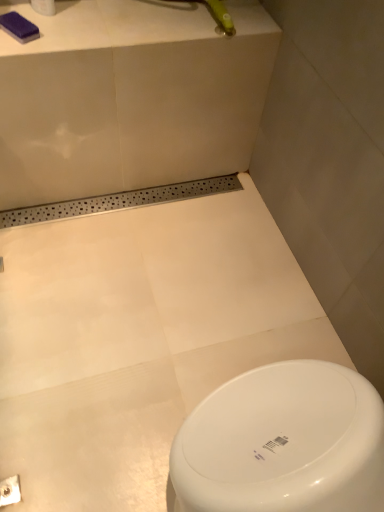
Find the location of `white glossy bath at lower center`. white glossy bath at lower center is located at coordinates (138, 339).

In order to face white glossy bath at lower center, should I rotate leftwards or rightwards?

Rotate right and turn 11.372 degrees.

The image size is (384, 512). What do you see at coordinates (138, 339) in the screenshot?
I see `white glossy bath at lower center` at bounding box center [138, 339].

At what (x,y) coordinates should I click in order to perform the action: click on white matte toilet paper at upper left. Please return your answer as a coordinate pair (x, y). This screenshot has height=512, width=384. Looking at the image, I should click on (44, 7).

What do you see at coordinates (44, 7) in the screenshot?
I see `white matte toilet paper at upper left` at bounding box center [44, 7].

The width and height of the screenshot is (384, 512). Find the location of `white glossy bath at lower center`. white glossy bath at lower center is located at coordinates (138, 339).

Consider the image. Does white matte toilet paper at upper left appear on the right side of white glossy bath at lower center?

Incorrect, white matte toilet paper at upper left is not on the right side of white glossy bath at lower center.

Does white matte toilet paper at upper left come behind white glossy bath at lower center?

Yes, white matte toilet paper at upper left is further from the camera.

Considering the points (51, 9) and (176, 298), which point is behind, point (51, 9) or point (176, 298)?

The point (176, 298) is farther from the camera.

From the image's perspective, between white matte toilet paper at upper left and white glossy bath at lower center, which one is located above?

white matte toilet paper at upper left appears higher in the image.

From a real-world perspective, between white matte toilet paper at upper left and white glossy bath at lower center, who is vertically higher?

white matte toilet paper at upper left, from a real-world perspective.

Considering the sizes of objects white matte toilet paper at upper left and white glossy bath at lower center in the image provided, who is wider, white matte toilet paper at upper left or white glossy bath at lower center?

With larger width is white glossy bath at lower center.

Based on the photo, considering the sizes of white matte toilet paper at upper left and white glossy bath at lower center in the image, is white matte toilet paper at upper left taller or shorter than white glossy bath at lower center?

In the image, white matte toilet paper at upper left appears to be shorter than white glossy bath at lower center.

Which of these two, white matte toilet paper at upper left or white glossy bath at lower center, is bigger?

With larger size is white glossy bath at lower center.

Is white matte toilet paper at upper left spatially inside white glossy bath at lower center, or outside of it?

white matte toilet paper at upper left is spatially situated outside white glossy bath at lower center.

Is white matte toilet paper at upper left far away from white glossy bath at lower center?

That's not correct — white matte toilet paper at upper left is a little close to white glossy bath at lower center.

Is white matte toilet paper at upper left facing towards white glossy bath at lower center?

No, white matte toilet paper at upper left is not facing towards white glossy bath at lower center.

What's the angular difference between white matte toilet paper at upper left and white glossy bath at lower center's facing directions?

There is a 137-degree angle between the facing directions of white matte toilet paper at upper left and white glossy bath at lower center.

Locate an element on the screen. This screenshot has height=512, width=384. toilet paper above the white glossy bath at lower center (from a real-world perspective) is located at coordinates (44, 7).

In the image, is white glossy bath at lower center on the left side or the right side of white matte toilet paper at upper left?

Clearly, white glossy bath at lower center is on the right of white matte toilet paper at upper left in the image.

Which is in front, white glossy bath at lower center or white matte toilet paper at upper left?

white glossy bath at lower center is closer to the camera.

Which is more distant, (83,456) or (41,3)?

The point (41,3) is behind.

From the image's perspective, does white glossy bath at lower center appear lower than white matte toilet paper at upper left?

Yes, from the image's perspective, white glossy bath at lower center is beneath white matte toilet paper at upper left.

From a real-world perspective, is white glossy bath at lower center under white matte toilet paper at upper left?

Indeed, from a real-world perspective, white glossy bath at lower center is positioned beneath white matte toilet paper at upper left.

Between white glossy bath at lower center and white matte toilet paper at upper left, which one has smaller width?

white matte toilet paper at upper left.

Between white glossy bath at lower center and white matte toilet paper at upper left, which one has less height?

white matte toilet paper at upper left is shorter.

Which of these two, white glossy bath at lower center or white matte toilet paper at upper left, is smaller?

With smaller size is white matte toilet paper at upper left.

Is white matte toilet paper at upper left a part of white glossy bath at lower center?

No.

Is white glossy bath at lower center far from white matte toilet paper at upper left?

No.

Is white glossy bath at lower center aimed at white matte toilet paper at upper left?

Yes, white glossy bath at lower center is aimed at white matte toilet paper at upper left.

How different are the orientations of white glossy bath at lower center and white matte toilet paper at upper left in degrees?

137 degrees separate the facing orientations of white glossy bath at lower center and white matte toilet paper at upper left.

Measure the distance from white glossy bath at lower center to white matte toilet paper at upper left.

white glossy bath at lower center is 32.26 inches away from white matte toilet paper at upper left.

This screenshot has width=384, height=512. What are the coordinates of `toilet paper above the white glossy bath at lower center (from a real-world perspective)` in the screenshot? It's located at (44, 7).

The image size is (384, 512). What are the coordinates of `toilet paper on the left of white glossy bath at lower center` in the screenshot? It's located at (44, 7).

Find the location of a particular element. The height and width of the screenshot is (512, 384). bath that appears below the white matte toilet paper at upper left (from a real-world perspective) is located at coordinates (138, 339).